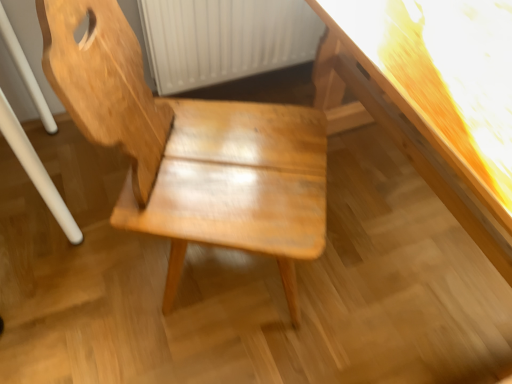
Where is `free location to the right of wooden chair at center`? This screenshot has width=512, height=384. free location to the right of wooden chair at center is located at coordinates (374, 264).